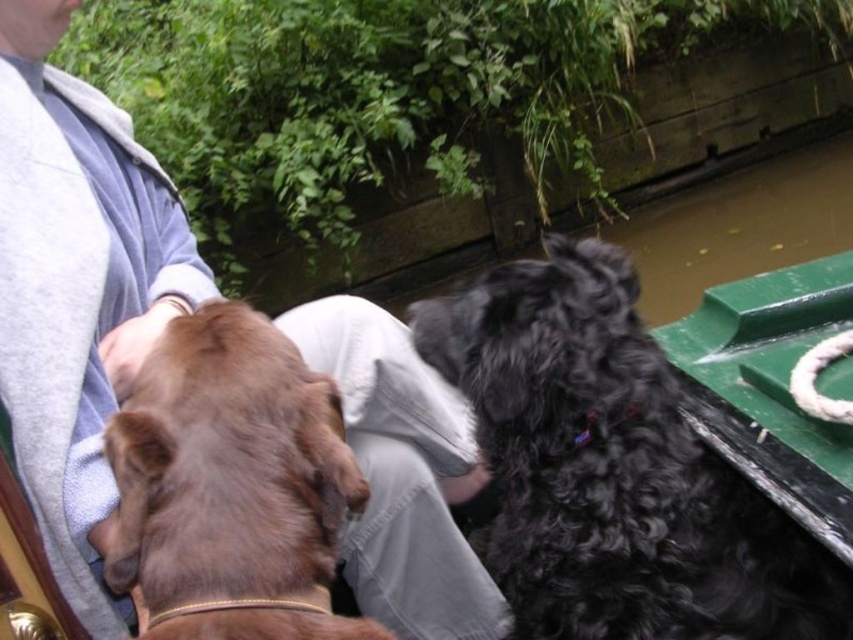
Is gray fleece jacket at upper left closer to the viewer compared to black curly fur dog at right?

Yes, gray fleece jacket at upper left is closer to the viewer.

What do you see at coordinates (77, 289) in the screenshot?
I see `gray fleece jacket at upper left` at bounding box center [77, 289].

Locate an element on the screen. gray fleece jacket at upper left is located at coordinates 77,289.

This screenshot has width=853, height=640. I want to click on black curly fur dog at right, so click(612, 468).

Is black curly fur dog at right in front of brown furry dog at left?

That is False.

You are a GUI agent. You are given a task and a screenshot of the screen. Output one action in this format:
    pyautogui.click(x=<x>, y=<y>)
    Task: Click on the black curly fur dog at right
    Image resolution: width=853 pixels, height=640 pixels.
    Given the screenshot: What is the action you would take?
    pyautogui.click(x=612, y=468)

Does gray fleece jacket at upper left lie in front of brown furry dog at left?

No, it is not.

Is gray fleece jacket at upper left below brown furry dog at left?

Correct, gray fleece jacket at upper left is located below brown furry dog at left.

Does point (161, 312) come farther from viewer compared to point (323, 573)?

That is True.

Find the location of `gray fleece jacket at upper left`. gray fleece jacket at upper left is located at coordinates (77, 289).